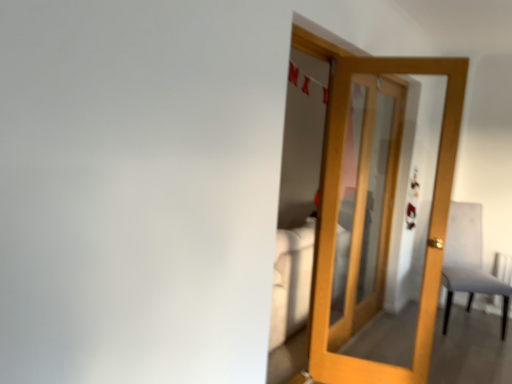
Identify the location of wooden door at center. (429, 223).

Describe the element at coordinates (429, 223) in the screenshot. I see `wooden door at center` at that location.

What is the approximate height of white fabric chair at right?

white fabric chair at right is 3.42 feet in height.

Describe the element at coordinates (468, 261) in the screenshot. I see `white fabric chair at right` at that location.

Image resolution: width=512 pixels, height=384 pixels. I want to click on white fabric chair at right, so click(468, 261).

This screenshot has height=384, width=512. What are the coordinates of `wooden door at center` in the screenshot? It's located at (429, 223).

Considering the relative positions of white fabric chair at right and wooden door at center in the image provided, is white fabric chair at right to the right of wooden door at center from the viewer's perspective?

Yes, white fabric chair at right is to the right of wooden door at center.

From the picture: Is white fabric chair at right in front of wooden door at center?

No, it is not.

Which is behind, point (474, 217) or point (387, 72)?

Point (474, 217)

From the image's perspective, is white fabric chair at right on top of wooden door at center?

No, from the image's perspective, white fabric chair at right is not over wooden door at center.

From a real-world perspective, is white fabric chair at right located higher than wooden door at center?

No, from a real-world perspective, white fabric chair at right is not over wooden door at center

Looking at their sizes, would you say white fabric chair at right is wider or thinner than wooden door at center?

In the image, white fabric chair at right appears to be wider than wooden door at center.

Does white fabric chair at right have a lesser height compared to wooden door at center?

Yes, white fabric chair at right is shorter than wooden door at center.

Considering the sizes of objects white fabric chair at right and wooden door at center in the image provided, who is bigger, white fabric chair at right or wooden door at center?

white fabric chair at right is bigger.

Is white fabric chair at right positioned beyond the bounds of wooden door at center?

white fabric chair at right lies outside wooden door at center's area.

Is white fabric chair at right touching wooden door at center?

white fabric chair at right is not next to wooden door at center, and they're not touching.

Looking at this image, is white fabric chair at right turned away from wooden door at center?

No, white fabric chair at right's orientation is not away from wooden door at center.

Measure the distance from white fabric chair at right to wooden door at center.

The distance of white fabric chair at right from wooden door at center is 5.02 feet.

The image size is (512, 384). Identify the location of chair located below the wooden door at center (from the image's perspective). tap(468, 261).

Does wooden door at center appear on the left side of white fabric chair at right?

Correct, you'll find wooden door at center to the left of white fabric chair at right.

Is the position of wooden door at center more distant than that of white fabric chair at right?

No, it is in front of white fabric chair at right.

Which is farther, (419, 316) or (457, 240)?

Point (457, 240)

From the image's perspective, who appears lower, wooden door at center or white fabric chair at right?

white fabric chair at right appears lower in the image.

From a real-world perspective, is wooden door at center physically located above or below white fabric chair at right?

wooden door at center is situated higher than white fabric chair at right in the real world.

Considering the sizes of objects wooden door at center and white fabric chair at right in the image provided, who is thinner, wooden door at center or white fabric chair at right?

wooden door at center is thinner.

From their relative heights in the image, would you say wooden door at center is taller or shorter than white fabric chair at right?

wooden door at center is taller than white fabric chair at right.

Is wooden door at center smaller than white fabric chair at right?

Correct, wooden door at center occupies less space than white fabric chair at right.

Is wooden door at center outside of white fabric chair at right?

wooden door at center lies outside white fabric chair at right's area.

Does wooden door at center touch white fabric chair at right?

They are not placed beside each other.

Is wooden door at center looking in the opposite direction of white fabric chair at right?

No.

Where is `chair located on the right of wooden door at center`? chair located on the right of wooden door at center is located at coordinates (468, 261).

Locate an element on the screen. This screenshot has height=384, width=512. door in front of the white fabric chair at right is located at coordinates (429, 223).

This screenshot has width=512, height=384. Find the location of `door above the white fabric chair at right (from a real-world perspective)`. door above the white fabric chair at right (from a real-world perspective) is located at coordinates (429, 223).